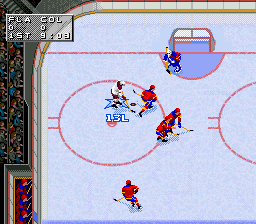
Find the location of a particular element. The image size is (256, 224). stand is located at coordinates (11, 125).